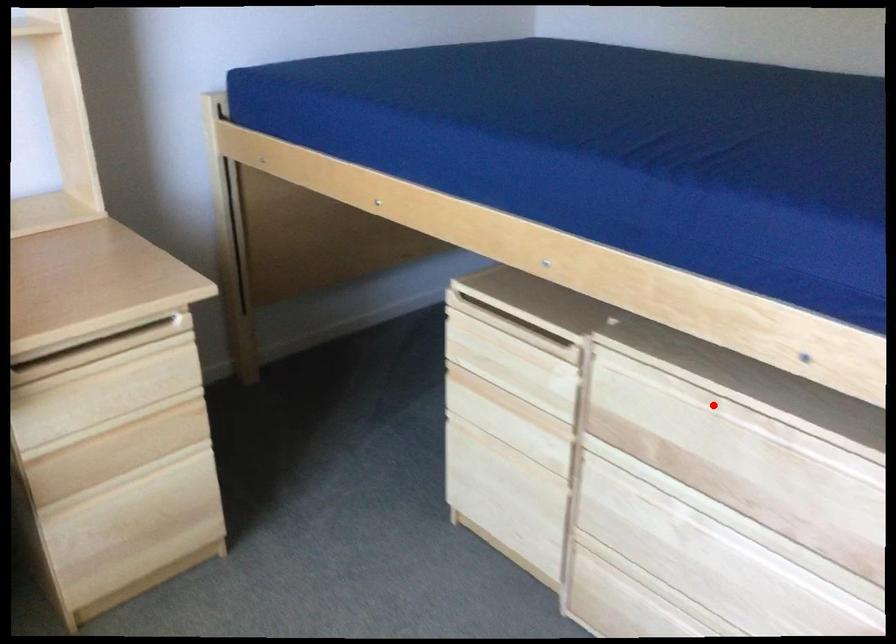
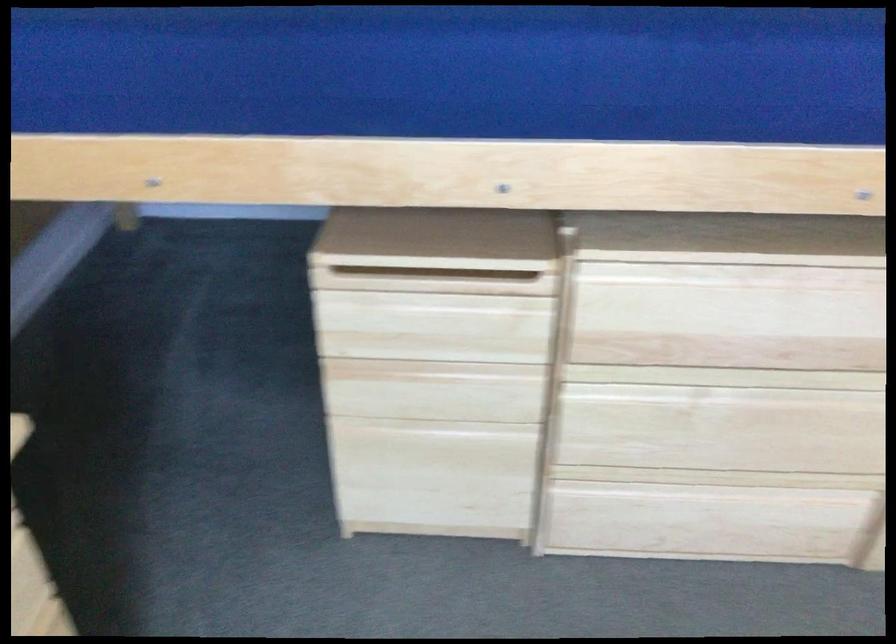
Where in the second image is the point corresponding to the highlighted location from the first image?

(737, 277)